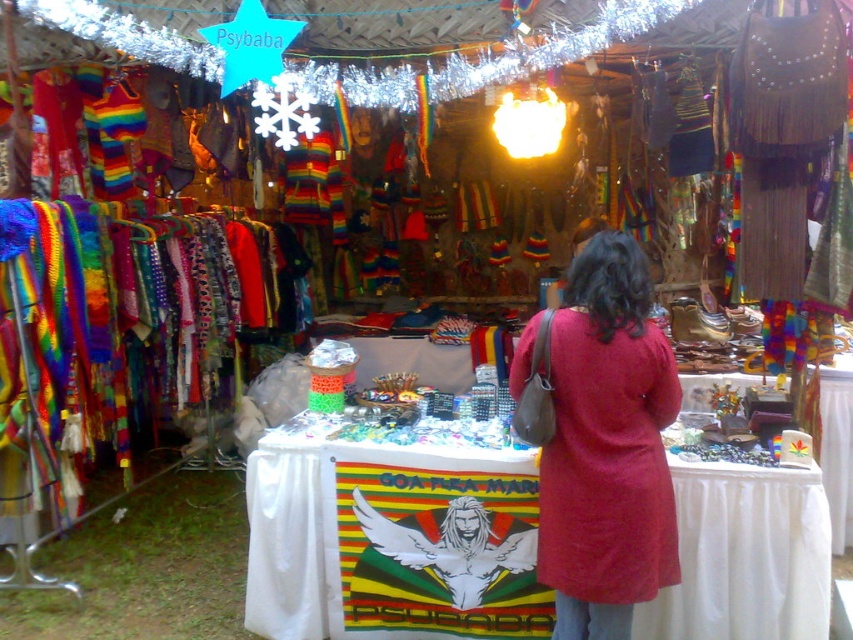
Does white cloth at center appear under matte red dress at center?

Yes, white cloth at center is below matte red dress at center.

Who is shorter, white cloth at center or matte red dress at center?

white cloth at center is shorter.

Who is more distant from viewer, (x=769, y=467) or (x=546, y=554)?

Point (x=769, y=467)

The height and width of the screenshot is (640, 853). I want to click on white cloth at center, so click(746, 556).